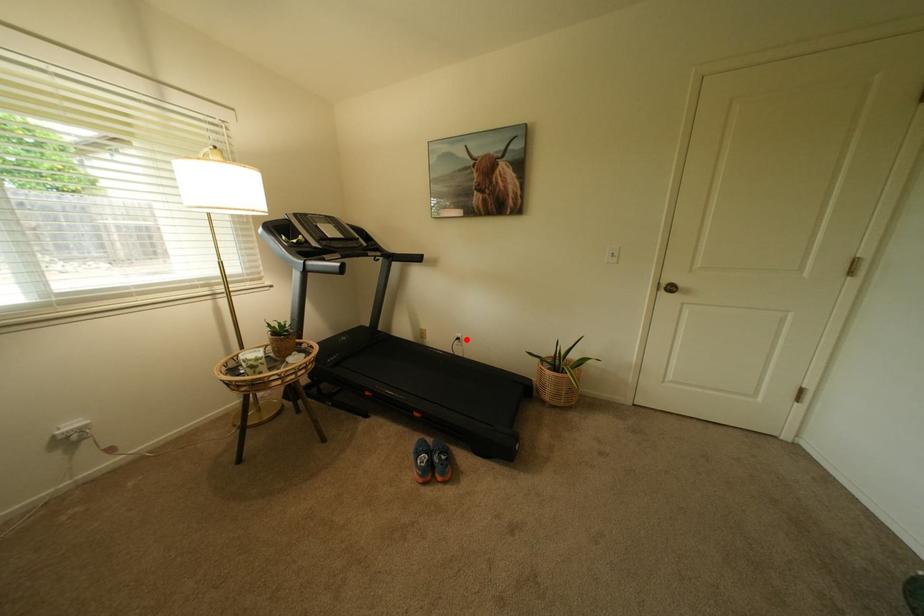
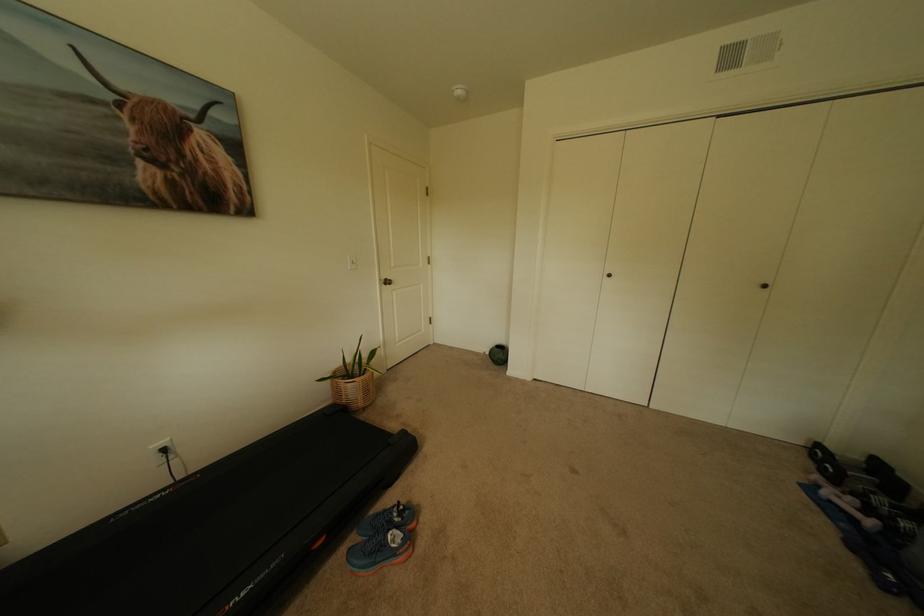
The point at the highlighted location is marked in the first image. Where is the corresponding point in the second image?

(173, 451)